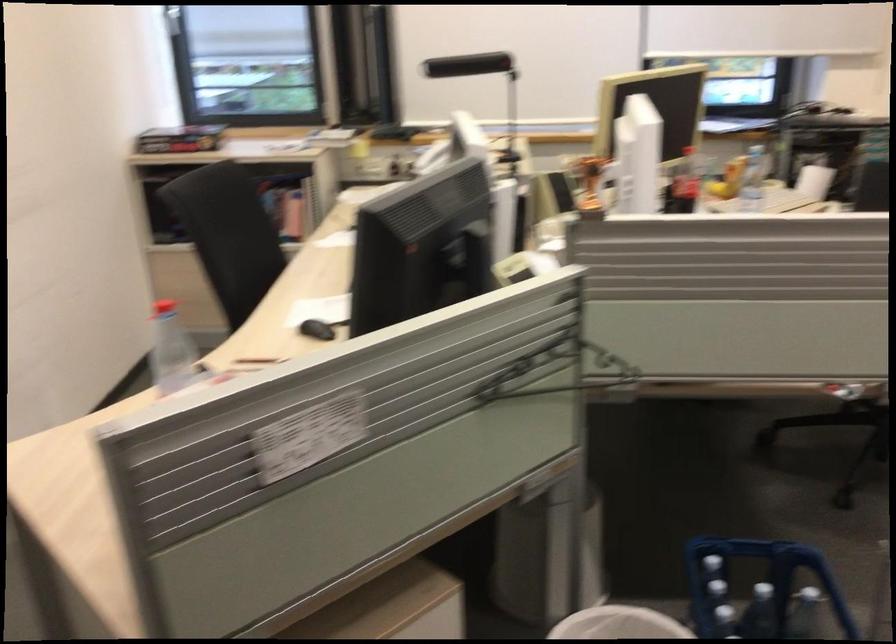
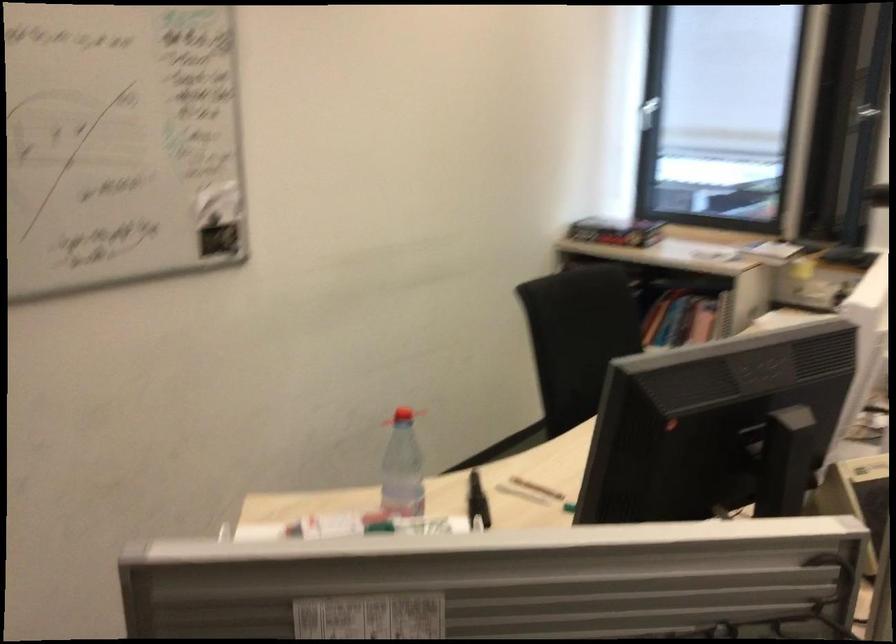
Locate, in the second image, the point that corresponds to point 191,144 in the first image.

(615, 232)